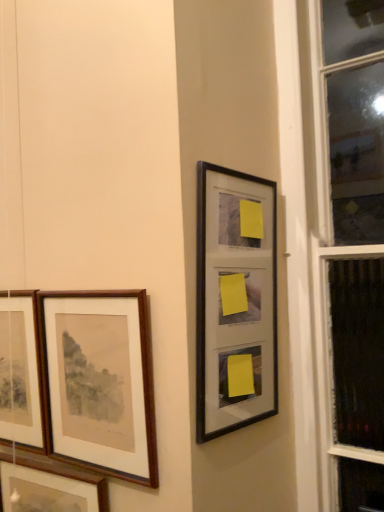
Question: Can you confirm if wooden frame at left, placed as the second picture frame when sorted from right to left, is bigger than wooden framed picture at left, which ranks as the second picture frame in left-to-right order?

Choices:
 (A) yes
 (B) no

Answer: (B)

Question: Does wooden frame at left, placed as the 3th picture frame when sorted from left to right, touch wooden framed picture at left, positioned as the 3th picture frame in right-to-left order?

Choices:
 (A) yes
 (B) no

Answer: (B)

Question: Considering the relative positions of wooden frame at left, placed as the 3th picture frame when sorted from left to right, and wooden framed picture at left, positioned as the 3th picture frame in right-to-left order, in the image provided, is wooden frame at left, placed as the 3th picture frame when sorted from left to right, to the left of wooden framed picture at left, positioned as the 3th picture frame in right-to-left order, from the viewer's perspective?

Choices:
 (A) yes
 (B) no

Answer: (B)

Question: Can you confirm if wooden frame at left, placed as the 3th picture frame when sorted from left to right, is smaller than wooden framed picture at left, which ranks as the second picture frame in left-to-right order?

Choices:
 (A) yes
 (B) no

Answer: (A)

Question: Is wooden frame at left, placed as the second picture frame when sorted from right to left, located outside wooden framed picture at left, which ranks as the second picture frame in left-to-right order?

Choices:
 (A) no
 (B) yes

Answer: (B)

Question: From their relative heights in the image, would you say wooden framed picture at left, which ranks as the second picture frame in left-to-right order, is taller or shorter than black matte picture frame at upper right, the fourth picture frame viewed from the left?

Choices:
 (A) short
 (B) tall

Answer: (A)

Question: Which is correct: wooden framed picture at left, positioned as the 3th picture frame in right-to-left order, is inside black matte picture frame at upper right, the fourth picture frame viewed from the left, or outside of it?

Choices:
 (A) inside
 (B) outside

Answer: (B)

Question: Visually, is wooden framed picture at left, which ranks as the second picture frame in left-to-right order, positioned to the left or to the right of black matte picture frame at upper right, the fourth picture frame viewed from the left?

Choices:
 (A) left
 (B) right

Answer: (A)

Question: From a real-world perspective, is wooden framed picture at left, which ranks as the second picture frame in left-to-right order, physically located above or below black matte picture frame at upper right, which is counted as the 1th picture frame, starting from the right?

Choices:
 (A) below
 (B) above

Answer: (A)

Question: In terms of width, does black matte picture frame at upper right, which is counted as the 1th picture frame, starting from the right, look wider or thinner when compared to wooden picture frame at left, arranged as the fourth picture frame when viewed from the right?

Choices:
 (A) wide
 (B) thin

Answer: (B)

Question: Is point (221, 296) positioned closer to the camera than point (31, 376)?

Choices:
 (A) farther
 (B) closer

Answer: (B)

Question: Considering the positions of black matte picture frame at upper right, the fourth picture frame viewed from the left, and wooden picture frame at left, the first picture frame from the left, in the image, is black matte picture frame at upper right, the fourth picture frame viewed from the left, bigger or smaller than wooden picture frame at left, the first picture frame from the left,?

Choices:
 (A) small
 (B) big

Answer: (A)

Question: Is black matte picture frame at upper right, the fourth picture frame viewed from the left, inside the boundaries of wooden picture frame at left, arranged as the fourth picture frame when viewed from the right, or outside?

Choices:
 (A) inside
 (B) outside

Answer: (B)

Question: Is wooden frame at left, placed as the 3th picture frame when sorted from left to right, spatially inside wooden picture frame at left, the first picture frame from the left, or outside of it?

Choices:
 (A) outside
 (B) inside

Answer: (A)

Question: In the image, is wooden frame at left, placed as the second picture frame when sorted from right to left, positioned in front of or behind wooden picture frame at left, the first picture frame from the left?

Choices:
 (A) front
 (B) behind

Answer: (A)